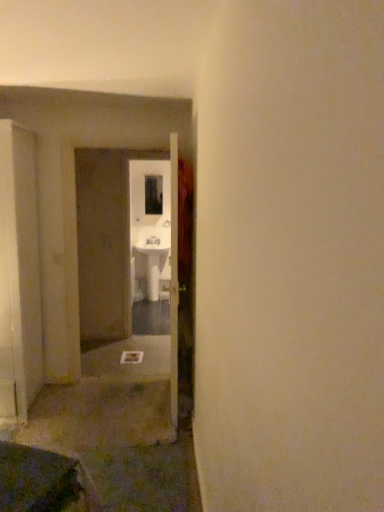
Question: Considering their positions, is transparent glass window at center located in front of or behind white glossy sink at center?

Choices:
 (A) behind
 (B) front

Answer: (A)

Question: Based on their sizes in the image, would you say transparent glass window at center is bigger or smaller than white glossy sink at center?

Choices:
 (A) big
 (B) small

Answer: (B)

Question: Choose the correct answer: Is transparent glass window at center inside white glossy sink at center or outside it?

Choices:
 (A) outside
 (B) inside

Answer: (A)

Question: From the image's perspective, is white glossy sink at center positioned above or below transparent glass window at center?

Choices:
 (A) above
 (B) below

Answer: (B)

Question: Is white glossy sink at center to the left or to the right of transparent glass window at center in the image?

Choices:
 (A) right
 (B) left

Answer: (A)

Question: Considering their positions, is white glossy sink at center located in front of or behind transparent glass window at center?

Choices:
 (A) front
 (B) behind

Answer: (A)

Question: Looking at the image, does white glossy sink at center seem bigger or smaller compared to transparent glass window at center?

Choices:
 (A) big
 (B) small

Answer: (A)